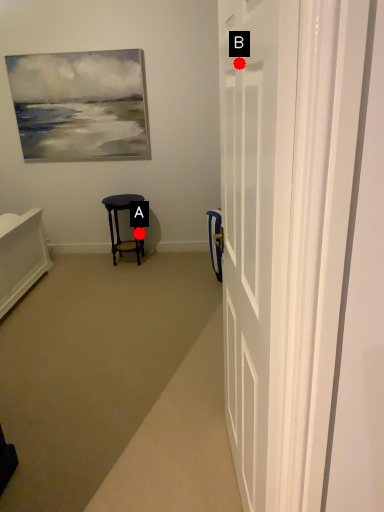
Question: Two points are circled on the image, labeled by A and B beside each circle. Which point is closer to the camera?

Choices:
 (A) A is closer
 (B) B is closer

Answer: (B)